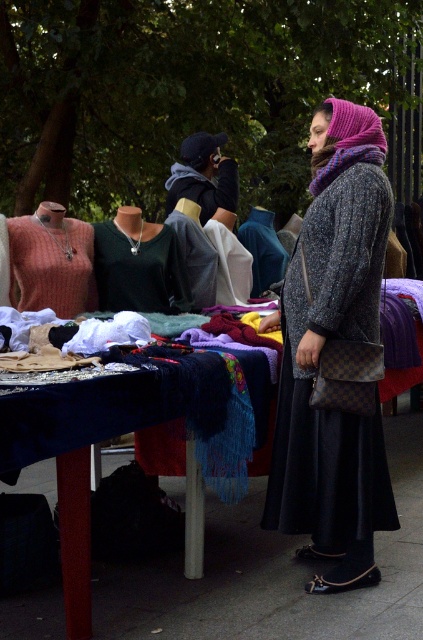
Question: Can you confirm if matte black top at center is wider than knitted wool scarf at center?

Choices:
 (A) no
 (B) yes

Answer: (B)

Question: Can you confirm if knitted coral sweater at left is positioned above matte black jacket at center?

Choices:
 (A) no
 (B) yes

Answer: (A)

Question: Can you confirm if knitted coral sweater at left is positioned to the right of matte black jacket at center?

Choices:
 (A) yes
 (B) no

Answer: (B)

Question: Which point is farther to the camera?

Choices:
 (A) sparkly gray coat at center
 (B) matte black top at center
 (C) knitted coral sweater at left
 (D) smooth concrete pavement at lower center

Answer: (B)

Question: Which point appears closest to the camera in this image?

Choices:
 (A) (90, 282)
 (B) (197, 147)
 (C) (249, 244)

Answer: (A)

Question: Which object is positioned closest to the matte black jacket at center?

Choices:
 (A) knitted wool scarf at center
 (B) matte black top at center

Answer: (A)